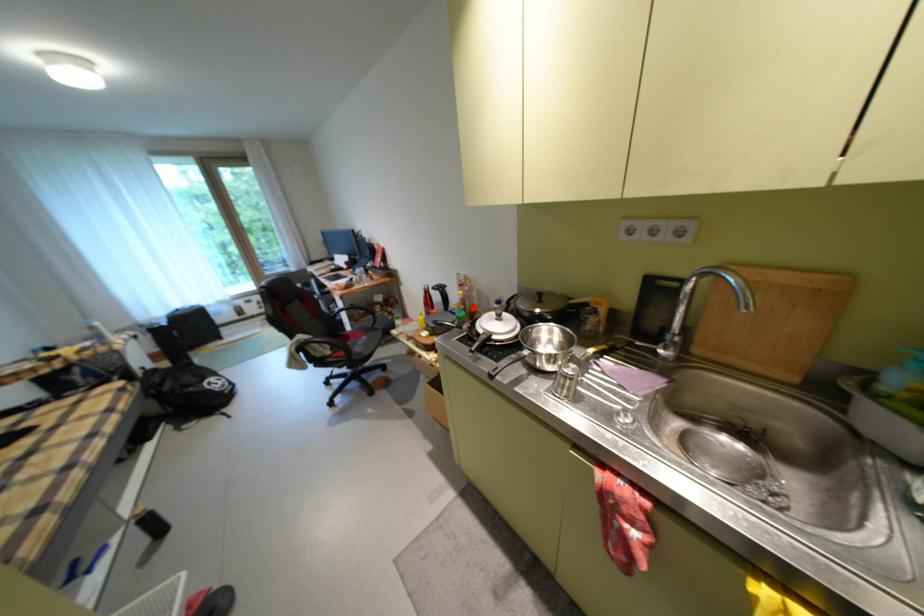
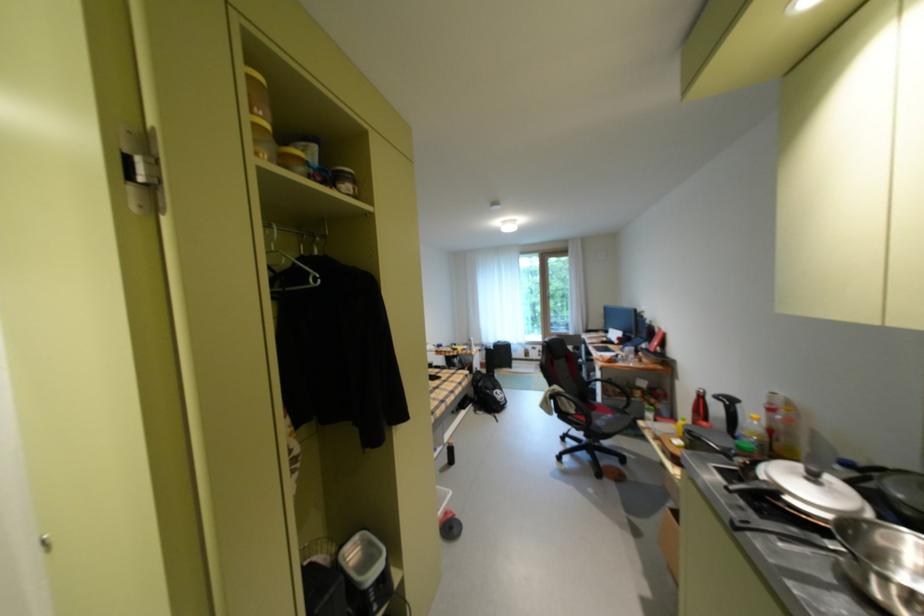
The point at the highlighted location is marked in the first image. Where is the corresponding point in the second image?

(766, 439)